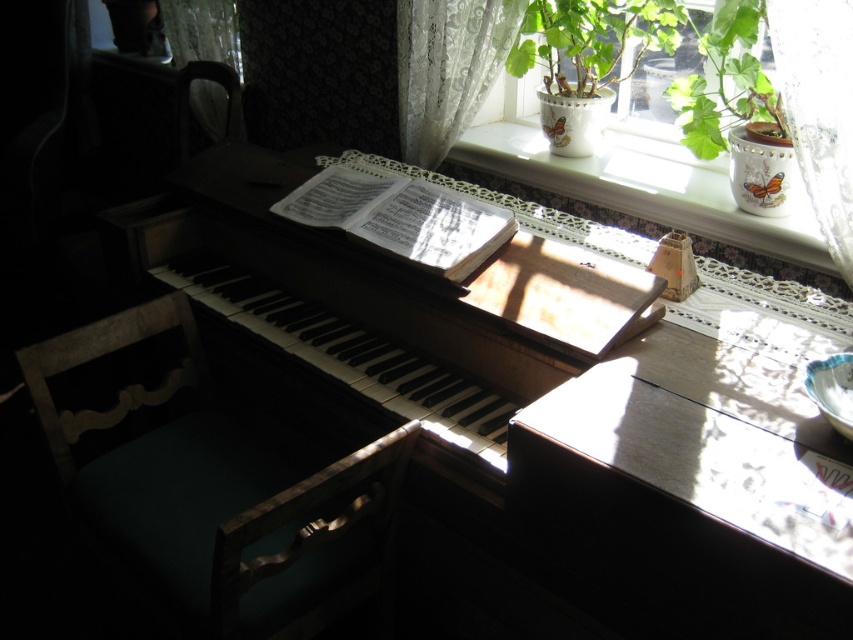
What is located at the coordinate point (645, 188) in the image?

The white lace at upper right is located at point (645, 188).

You are a person with a 20 inch wide backpack. You are standing in front of the white lace curtain at upper right and the green leafy plant at upper right. Can you walk through the space between them?

The white lace curtain at upper right and green leafy plant at upper right are 22.14 inches apart from each other. Since your backpack is 20 inches wide, you can walk through the space between them as the distance is wider than your backpack.

You are a guest in this room and want to sit down. You see the green fabric chair at lower left and the green leafy plant at upper right. Which one is wider?

The green fabric chair at lower left might be wider than the green leafy plant at upper right.